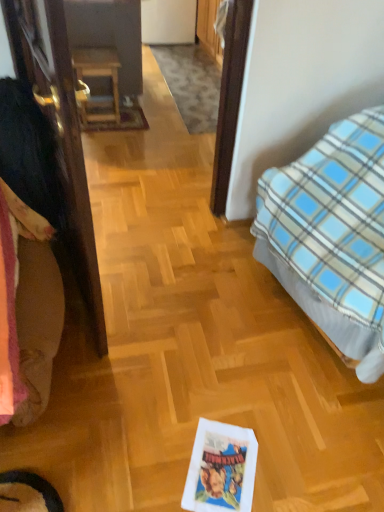
Question: In terms of height, does wooden table at center look taller or shorter compared to brown wooden door at left?

Choices:
 (A) tall
 (B) short

Answer: (B)

Question: Which is correct: wooden table at center is inside brown wooden door at left, or outside of it?

Choices:
 (A) outside
 (B) inside

Answer: (A)

Question: Which object is the farthest from the blue plaid blanket at right?

Choices:
 (A) fluffy beige blanket at left
 (B) brown wooden door at left
 (C) wooden table at center

Answer: (C)

Question: Which is nearer to the fluffy beige blanket at left?

Choices:
 (A) wooden table at center
 (B) blue plaid blanket at right
 (C) brown wooden door at left

Answer: (C)